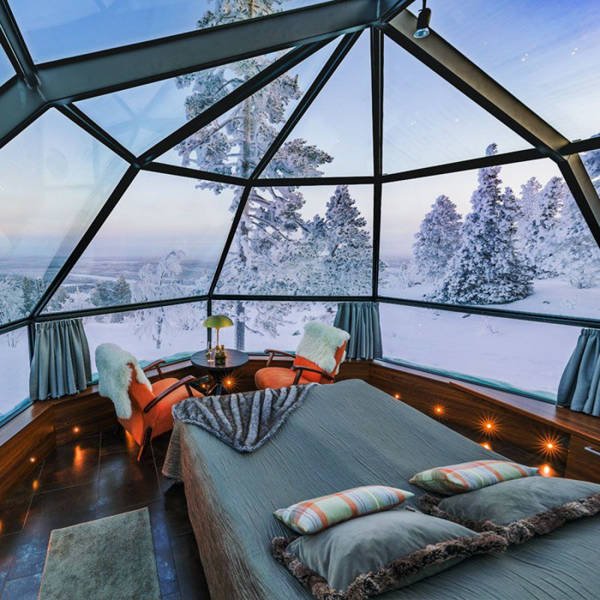
You are a GUI agent. You are given a task and a screenshot of the screen. Output one action in this format:
    pyautogui.click(x=<x>, y=<y>)
    Task: Click on the round table
    Image resolution: width=600 pixels, height=600 pixels.
    Given the screenshot: What is the action you would take?
    pyautogui.click(x=206, y=359)